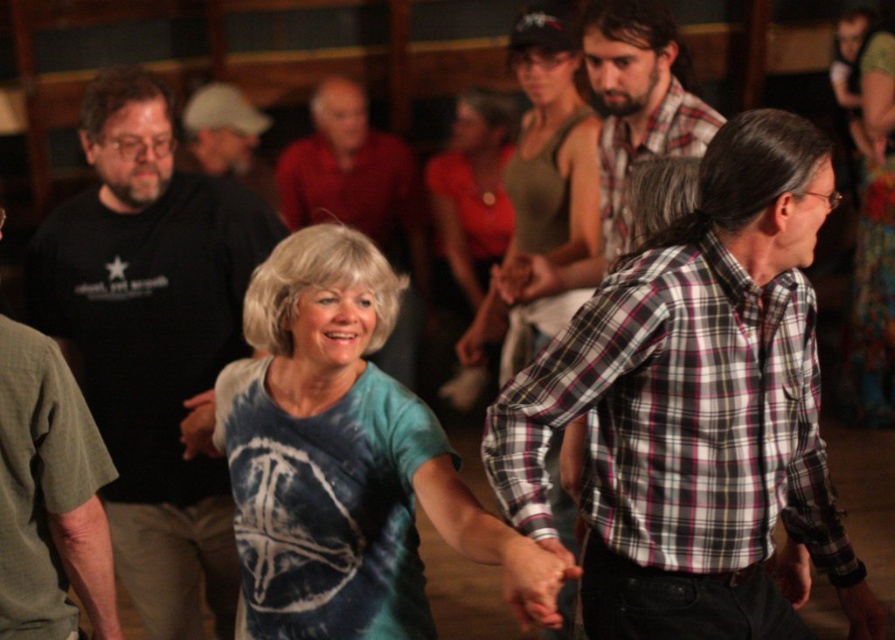
Is tie-dye fabric shirt at center to the right of matte black shirt at center from the viewer's perspective?

Indeed, tie-dye fabric shirt at center is positioned on the right side of matte black shirt at center.

Between point (452, 492) and point (408, 348), which one is positioned in front?

Positioned in front is point (452, 492).

You are a GUI agent. You are given a task and a screenshot of the screen. Output one action in this format:
    pyautogui.click(x=<x>, y=<y>)
    Task: Click on the tie-dye fabric shirt at center
    
    Given the screenshot: What is the action you would take?
    pyautogui.click(x=344, y=460)

Is plaid shirt at right smaller than matte red shirt at center?

No, plaid shirt at right is not smaller than matte red shirt at center.

This screenshot has width=895, height=640. Find the location of `plaid shirt at right`. plaid shirt at right is located at coordinates (696, 408).

Which is behind, point (543, 493) or point (484, 371)?

The point (484, 371) is behind.

Find the location of a particular element. This screenshot has height=640, width=895. plaid shirt at right is located at coordinates (696, 408).

Is point (13, 346) positioned before point (403, 141)?

That is True.

Which of these two, dark green t-shirt at left or matte black shirt at center, stands taller?

Standing taller between the two is matte black shirt at center.

Is point (67, 492) positioned in front of point (331, 156)?

Yes, it is in front of point (331, 156).

Find the location of `dark green t-shirt at left`. dark green t-shirt at left is located at coordinates (49, 497).